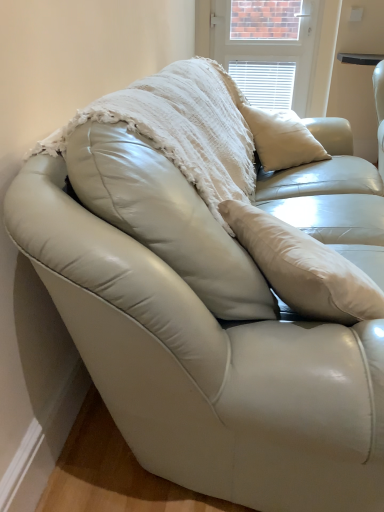
Question: Is the depth of white leather table at upper right greater than that of white textured blinds at upper center?

Choices:
 (A) no
 (B) yes

Answer: (A)

Question: Does white leather table at upper right have a smaller size compared to white textured blinds at upper center?

Choices:
 (A) no
 (B) yes

Answer: (A)

Question: Is white textured blinds at upper center surrounded by white leather table at upper right?

Choices:
 (A) yes
 (B) no

Answer: (B)

Question: Is white leather table at upper right oriented towards white textured blinds at upper center?

Choices:
 (A) no
 (B) yes

Answer: (A)

Question: Can you confirm if white leather table at upper right is bigger than white textured blinds at upper center?

Choices:
 (A) no
 (B) yes

Answer: (B)

Question: Is white leather table at upper right positioned with its back to white textured blinds at upper center?

Choices:
 (A) no
 (B) yes

Answer: (A)

Question: Is the depth of white textured blinds at upper center less than that of white leather table at upper right?

Choices:
 (A) no
 (B) yes

Answer: (A)

Question: Can white leather table at upper right be found inside white textured blinds at upper center?

Choices:
 (A) yes
 (B) no

Answer: (B)

Question: Is white textured blinds at upper center thinner than white leather table at upper right?

Choices:
 (A) yes
 (B) no

Answer: (A)

Question: Considering the relative sizes of white textured blinds at upper center and white leather table at upper right in the image provided, is white textured blinds at upper center taller than white leather table at upper right?

Choices:
 (A) no
 (B) yes

Answer: (B)

Question: Is white leather table at upper right at the back of white textured blinds at upper center?

Choices:
 (A) yes
 (B) no

Answer: (B)

Question: From the image's perspective, is white textured blinds at upper center beneath white leather table at upper right?

Choices:
 (A) yes
 (B) no

Answer: (B)

Question: Is white leather table at upper right located within white textured blanket at center?

Choices:
 (A) no
 (B) yes

Answer: (A)